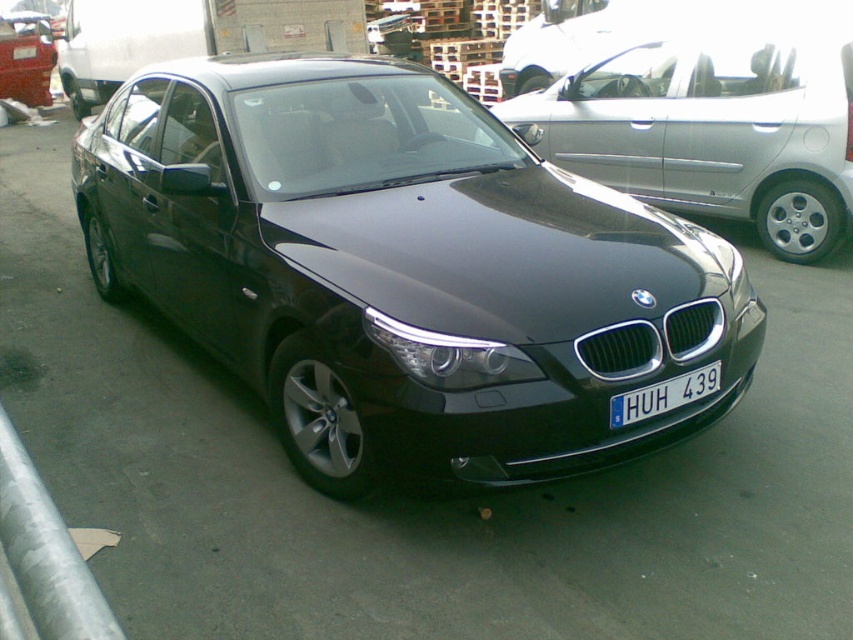
You are standing in front of the dark BMW sedan and want to determine which of the two points, point (665,51) or point (624,397), is closer to you. Based on the car and its position, which point is nearer?

Point (665,51) is closer to you because it is further to the viewer than point (624,397).

You are a delivery driver who needs to park your truck next to the metallic gray curb at lower left without hitting the blue metallic license plate at center. Considering their heights, which one should you be more cautious about when backing up?

The metallic gray curb at lower left has a greater height compared to the blue metallic license plate at center. Therefore, you should be more cautious about the metallic gray curb at lower left when backing up to avoid collision due to its higher elevation.